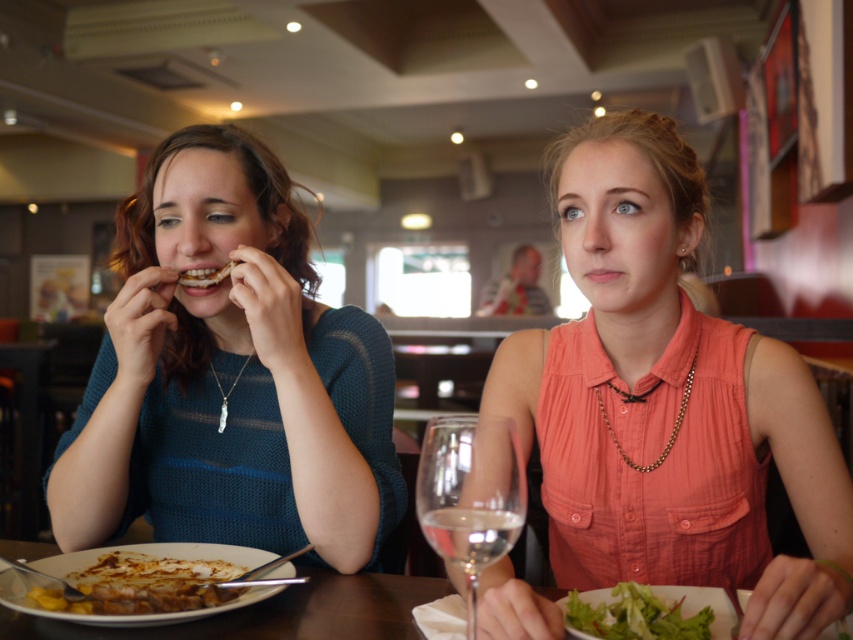
You are a waiter at a restaurant and need to place a new drink order for the person at the table. The drink needs to be placed on the table at the point marked by coordinates point (x=469, y=493). However, there is already an object there. What is the object currently occupying that spot?

The point (x=469, y=493) marks transparent glass at center, so the object currently occupying that spot is the transparent glass at center.

You are a photographer trying to capture a candid shot of the gold chain necklace at center without obstructing the view with the matte coral blouse at center. Is this possible given their current positions?

The matte coral blouse at center is in front of the gold chain necklace at center, so it would block the view. Move the camera angle slightly to the side to avoid the blouse and still capture the necklace.

You are a waiter at a restaurant and need to place a new dish on the table. The table has coordinates from 0 to 1 in both x and y directions. The golden brown steak at lower left is located at point (142, 586). If you want to place the new dish as far away as possible from the golden brown steak at lower left, where should you place it?

To place the new dish as far away as possible from the golden brown steak at lower left located at point (142, 586), you should place it at the point diagonally opposite, which would be the upper right corner of the table. The coordinates for the farthest point would be approximately 0.084, 0.832.